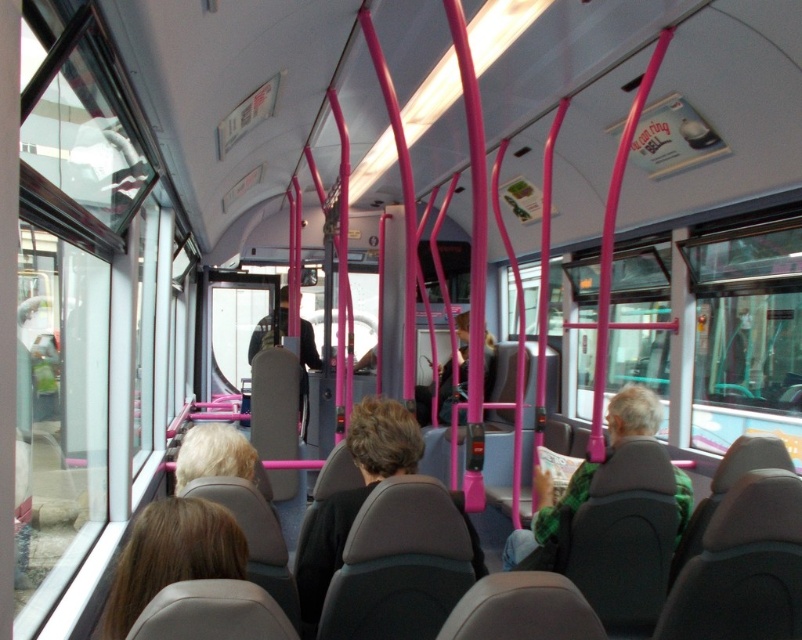
Can you confirm if black fabric jacket at center is smaller than dark green sweater at center?

Correct, black fabric jacket at center occupies less space than dark green sweater at center.

Is black fabric jacket at center positioned behind dark green sweater at center?

No.

Identify the location of black fabric jacket at center. (353, 496).

Is black fabric jacket at center to the left of dark gray fabric jacket at center from the viewer's perspective?

No, black fabric jacket at center is not to the left of dark gray fabric jacket at center.

Is black fabric jacket at center positioned before dark gray fabric jacket at center?

Yes, black fabric jacket at center is closer to the viewer.

In order to click on black fabric jacket at center in this screenshot , I will do `click(353, 496)`.

Who is more distant from viewer, (643, 424) or (456, 342)?

Point (456, 342)

Between green plaid shirt at center and dark green sweater at center, which one appears on the left side from the viewer's perspective?

Positioned to the left is dark green sweater at center.

Where is `green plaid shirt at center`? This screenshot has width=802, height=640. green plaid shirt at center is located at coordinates (547, 513).

This screenshot has width=802, height=640. Identify the location of green plaid shirt at center. (547, 513).